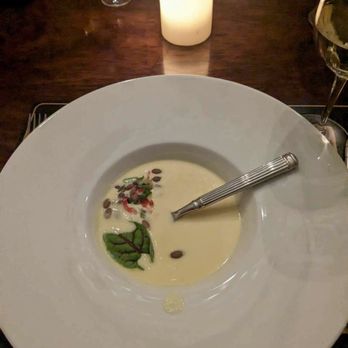
The width and height of the screenshot is (348, 348). Identify the location of candle. (186, 21).